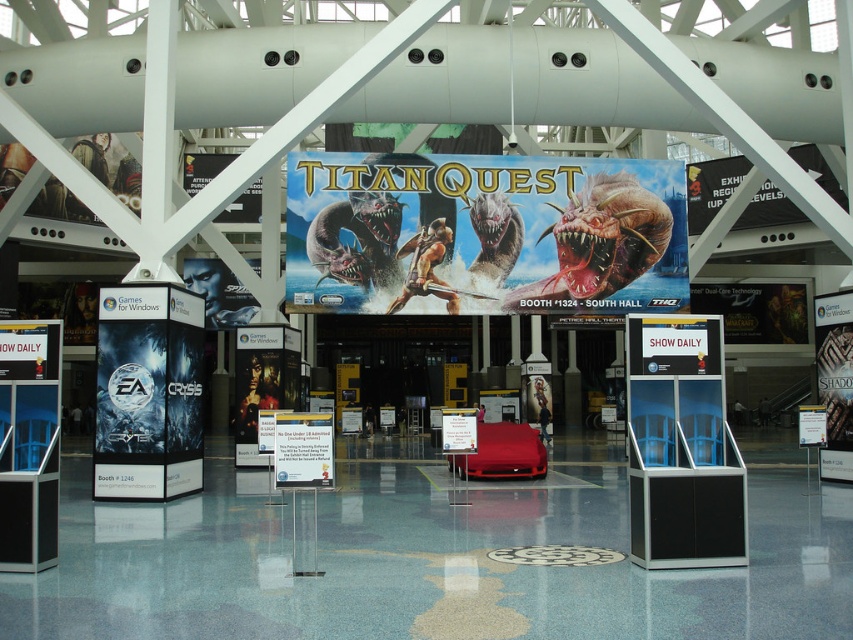
Question: Among these points, which one is nearest to the camera?

Choices:
 (A) (306, 176)
 (B) (720, 298)

Answer: (A)

Question: Which of the following is the farthest from the observer?

Choices:
 (A) (648, 300)
 (B) (795, 316)
 (C) (292, 445)

Answer: (B)

Question: Does metallic blue banner at center appear on the right side of metallic silver sign at right?

Choices:
 (A) yes
 (B) no

Answer: (B)

Question: Is metallic silver sign at right bigger than white paper sign at center?

Choices:
 (A) no
 (B) yes

Answer: (B)

Question: Which point is farther from the camera taking this photo?

Choices:
 (A) (641, 289)
 (B) (312, 460)
 (C) (699, 310)

Answer: (C)

Question: Can you confirm if metallic silver sign at right is wider than white paper sign at center?

Choices:
 (A) yes
 (B) no

Answer: (A)